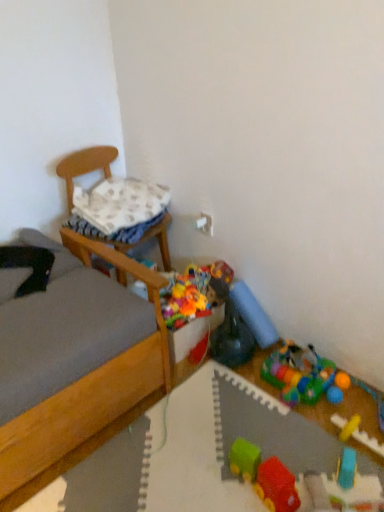
Question: From a real-world perspective, is white textured pillow at upper left under rubberized plastic toy at lower right, the 6th toy when ordered from front to back?

Choices:
 (A) yes
 (B) no

Answer: (B)

Question: Is white textured pillow at upper left turned away from rubberized plastic toy at lower right, placed as the first toy when sorted from back to front?

Choices:
 (A) no
 (B) yes

Answer: (A)

Question: Is white textured pillow at upper left far away from rubberized plastic toy at lower right, placed as the first toy when sorted from back to front?

Choices:
 (A) no
 (B) yes

Answer: (A)

Question: Would you say white textured pillow at upper left contains rubberized plastic toy at lower right, placed as the first toy when sorted from back to front?

Choices:
 (A) no
 (B) yes

Answer: (A)

Question: Does white textured pillow at upper left appear on the left side of rubberized plastic toy at lower right, the 6th toy when ordered from front to back?

Choices:
 (A) no
 (B) yes

Answer: (B)

Question: Is point (69, 162) positioned closer to the camera than point (292, 479)?

Choices:
 (A) closer
 (B) farther

Answer: (B)

Question: Is wooden chair at left wider or thinner than rubberized plastic train at center, positioned as the 6th toy in back-to-front order?

Choices:
 (A) wide
 (B) thin

Answer: (A)

Question: From the image's perspective, relative to rubberized plastic train at center, positioned as the 6th toy in back-to-front order, is wooden chair at left above or below?

Choices:
 (A) below
 (B) above

Answer: (B)

Question: Considering their positions, is wooden chair at left located in front of or behind rubberized plastic train at center, positioned as the 6th toy in back-to-front order?

Choices:
 (A) behind
 (B) front

Answer: (A)

Question: Is rubberized plastic train at center, positioned as the 6th toy in back-to-front order, to the left or to the right of wooden chair at left in the image?

Choices:
 (A) left
 (B) right

Answer: (B)

Question: Choose the correct answer: Is rubberized plastic train at center, positioned as the 6th toy in back-to-front order, inside wooden chair at left or outside it?

Choices:
 (A) inside
 (B) outside

Answer: (B)

Question: From their relative heights in the image, would you say rubberized plastic train at center, the 1th toy in the front-to-back sequence, is taller or shorter than wooden chair at left?

Choices:
 (A) tall
 (B) short

Answer: (B)

Question: From a real-world perspective, is rubberized plastic train at center, positioned as the 6th toy in back-to-front order, above or below wooden chair at left?

Choices:
 (A) below
 (B) above

Answer: (A)

Question: Is rubberized plastic play mat at lower right, the third toy viewed from the back, to the left or to the right of rubberized plastic train at center, the 1th toy in the front-to-back sequence, in the image?

Choices:
 (A) left
 (B) right

Answer: (B)

Question: Looking at the image, does rubberized plastic play mat at lower right, the third toy viewed from the back, seem bigger or smaller compared to rubberized plastic train at center, the 1th toy in the front-to-back sequence?

Choices:
 (A) big
 (B) small

Answer: (B)